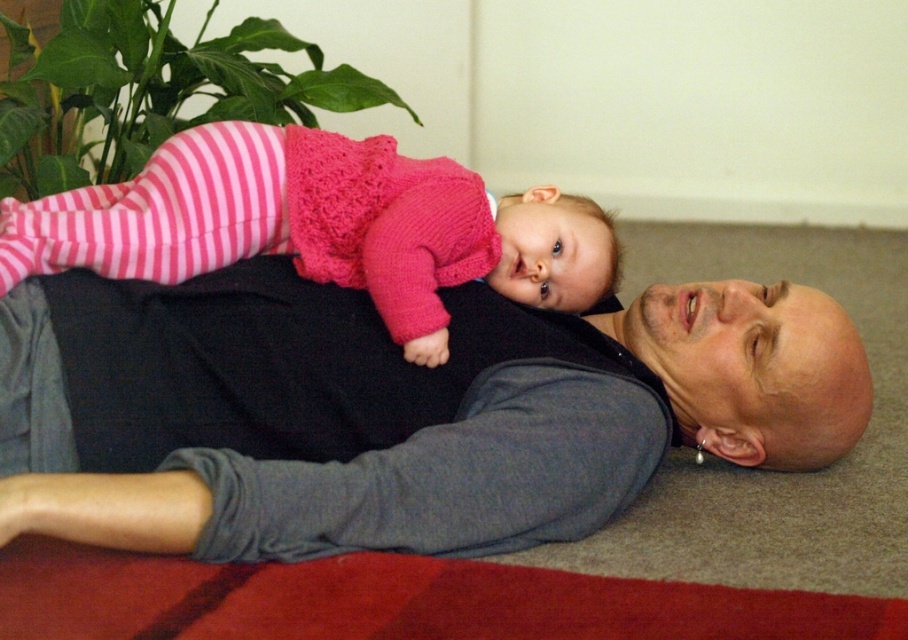
Can you confirm if gray soft shirt at center is shorter than pink knitted sweater at upper center?

No.

Can you confirm if gray soft shirt at center is positioned to the left of pink knitted sweater at upper center?

No, gray soft shirt at center is not to the left of pink knitted sweater at upper center.

Describe the element at coordinates (392, 412) in the screenshot. This screenshot has height=640, width=908. I see `gray soft shirt at center` at that location.

This screenshot has height=640, width=908. I want to click on gray soft shirt at center, so click(x=392, y=412).